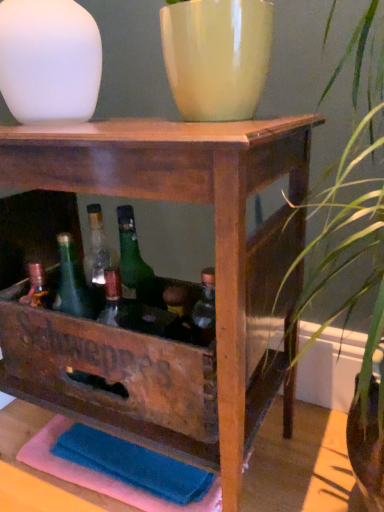
Question: Is matte green glass bottle at center to the right of white matte vase at upper left from the viewer's perspective?

Choices:
 (A) yes
 (B) no

Answer: (A)

Question: Does matte green glass bottle at center have a greater height compared to white matte vase at upper left?

Choices:
 (A) no
 (B) yes

Answer: (A)

Question: Can you confirm if matte green glass bottle at center is wider than white matte vase at upper left?

Choices:
 (A) yes
 (B) no

Answer: (B)

Question: Is matte green glass bottle at center with white matte vase at upper left?

Choices:
 (A) yes
 (B) no

Answer: (B)

Question: Is matte green glass bottle at center positioned in front of white matte vase at upper left?

Choices:
 (A) no
 (B) yes

Answer: (A)

Question: Does point (180, 337) appear closer or farther from the camera than point (109, 373)?

Choices:
 (A) farther
 (B) closer

Answer: (B)

Question: In the image, is matte green glass bottle at center on the left side or the right side of wooden crate at center?

Choices:
 (A) left
 (B) right

Answer: (B)

Question: In terms of size, does matte green glass bottle at center appear bigger or smaller than wooden crate at center?

Choices:
 (A) big
 (B) small

Answer: (B)

Question: Is matte green glass bottle at center in front of or behind wooden crate at center in the image?

Choices:
 (A) behind
 (B) front

Answer: (A)

Question: Is white matte vase at upper left spatially inside wooden crate at center, or outside of it?

Choices:
 (A) inside
 (B) outside

Answer: (B)

Question: From a real-world perspective, is white matte vase at upper left positioned above or below wooden crate at center?

Choices:
 (A) above
 (B) below

Answer: (A)

Question: From their relative heights in the image, would you say white matte vase at upper left is taller or shorter than wooden crate at center?

Choices:
 (A) short
 (B) tall

Answer: (A)

Question: Visually, is white matte vase at upper left positioned to the left or to the right of wooden crate at center?

Choices:
 (A) left
 (B) right

Answer: (A)

Question: Is point (188, 50) closer or farther from the camera than point (86, 71)?

Choices:
 (A) farther
 (B) closer

Answer: (B)

Question: From the image's perspective, relative to white matte vase at upper left, is matte yellow vase at upper center above or below?

Choices:
 (A) above
 (B) below

Answer: (B)